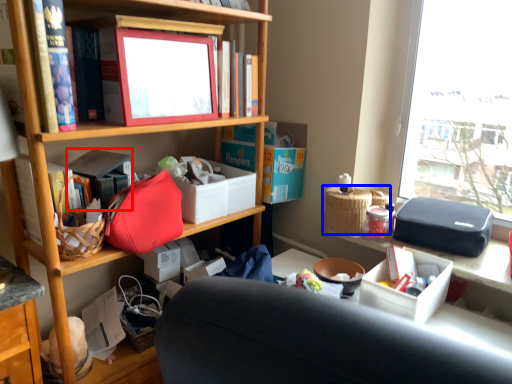
Question: Which object is further to the camera taking this photo, book (highlighted by a red box) or picnic basket (highlighted by a blue box)?

Choices:
 (A) book
 (B) picnic basket

Answer: (B)